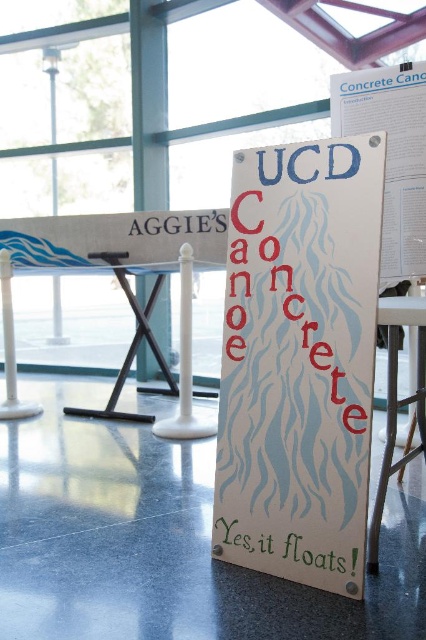
Question: Where is white paper at upper center located in relation to white glossy table at right in the image?

Choices:
 (A) right
 (B) left

Answer: (A)

Question: Which object is farther from the camera taking this photo?

Choices:
 (A) blue paper sign at center
 (B) white paper at upper right

Answer: (B)

Question: Does white paper at upper center have a smaller size compared to white glossy table at right?

Choices:
 (A) yes
 (B) no

Answer: (A)

Question: Which object is closer to the camera taking this photo?

Choices:
 (A) black paper at center
 (B) white paper at upper right
 (C) green painted wood yes, it floats! at lower center

Answer: (C)

Question: Is matte white signboard at center smaller than white paper at upper center?

Choices:
 (A) yes
 (B) no

Answer: (B)

Question: Which point appears closest to the camera in this image?

Choices:
 (A) (245, 204)
 (B) (416, 65)

Answer: (A)